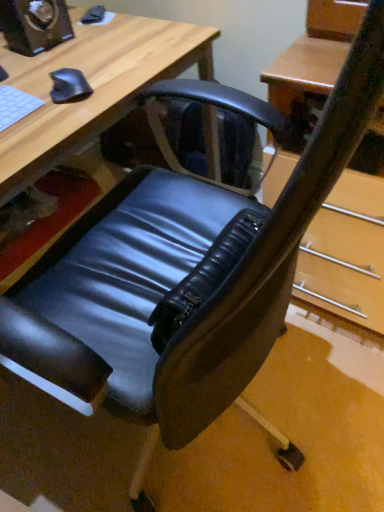
Locate an element on the screen. free point in front of matte black speaker at upper left is located at coordinates (45, 66).